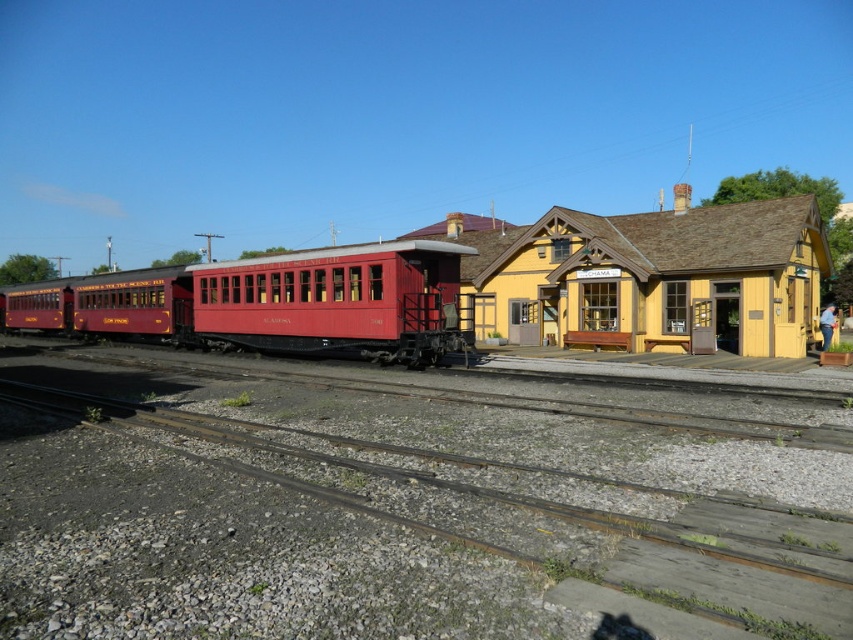
Who is positioned more to the left, gravel at center or matte red train car at center?

Positioned to the left is matte red train car at center.

Can you confirm if gravel at center is shorter than matte red train car at center?

Correct, gravel at center is not as tall as matte red train car at center.

Where is `gravel at center`? The image size is (853, 640). gravel at center is located at coordinates (395, 515).

Locate an element on the screen. The height and width of the screenshot is (640, 853). gravel at center is located at coordinates [395, 515].